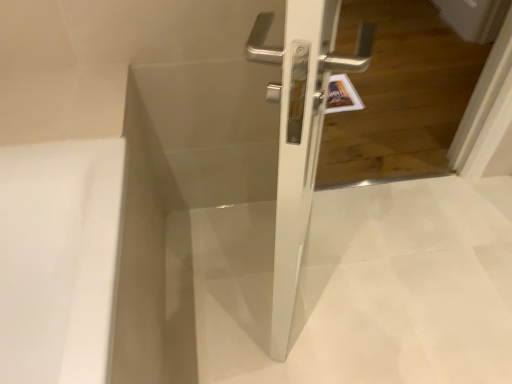
Image resolution: width=512 pixels, height=384 pixels. What do you see at coordinates (300, 131) in the screenshot? I see `white glossy door at center` at bounding box center [300, 131].

In order to click on white glossy door at center in this screenshot , I will do `click(300, 131)`.

You are a GUI agent. You are given a task and a screenshot of the screen. Output one action in this format:
    pyautogui.click(x=<x>, y=<y>)
    Task: Click on the white glossy door at center
    
    Given the screenshot: What is the action you would take?
    pyautogui.click(x=300, y=131)